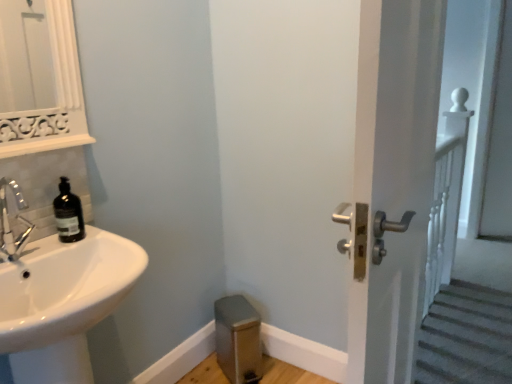
Question: Can you confirm if white glossy door handle at right is taller than matte black soap dispenser at left?

Choices:
 (A) yes
 (B) no

Answer: (A)

Question: Does white glossy door handle at right lie in front of matte black soap dispenser at left?

Choices:
 (A) yes
 (B) no

Answer: (B)

Question: Would you say white glossy door handle at right is outside matte black soap dispenser at left?

Choices:
 (A) no
 (B) yes

Answer: (B)

Question: From the image's perspective, is white glossy door handle at right on matte black soap dispenser at left?

Choices:
 (A) no
 (B) yes

Answer: (A)

Question: Is white glossy door handle at right aimed at matte black soap dispenser at left?

Choices:
 (A) yes
 (B) no

Answer: (B)

Question: Is matte black soap dispenser at left surrounded by white glossy door handle at right?

Choices:
 (A) no
 (B) yes

Answer: (A)

Question: From the image's perspective, is brushed metal step stool at lower center over matte black soap dispenser at left?

Choices:
 (A) no
 (B) yes

Answer: (A)

Question: Does brushed metal step stool at lower center have a greater height compared to matte black soap dispenser at left?

Choices:
 (A) no
 (B) yes

Answer: (B)

Question: Considering the relative positions of brushed metal step stool at lower center and matte black soap dispenser at left in the image provided, is brushed metal step stool at lower center to the left of matte black soap dispenser at left from the viewer's perspective?

Choices:
 (A) no
 (B) yes

Answer: (A)

Question: Considering the relative sizes of brushed metal step stool at lower center and matte black soap dispenser at left in the image provided, is brushed metal step stool at lower center bigger than matte black soap dispenser at left?

Choices:
 (A) no
 (B) yes

Answer: (B)

Question: From a real-world perspective, is brushed metal step stool at lower center beneath matte black soap dispenser at left?

Choices:
 (A) yes
 (B) no

Answer: (A)

Question: Could you tell me if brushed metal step stool at lower center is facing matte black soap dispenser at left?

Choices:
 (A) no
 (B) yes

Answer: (A)

Question: From a real-world perspective, is matte black soap dispenser at left below white glossy sink at lower left?

Choices:
 (A) no
 (B) yes

Answer: (A)